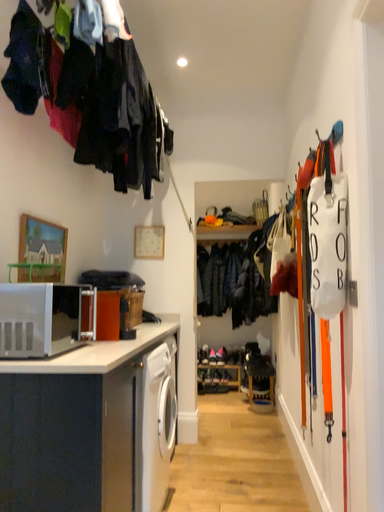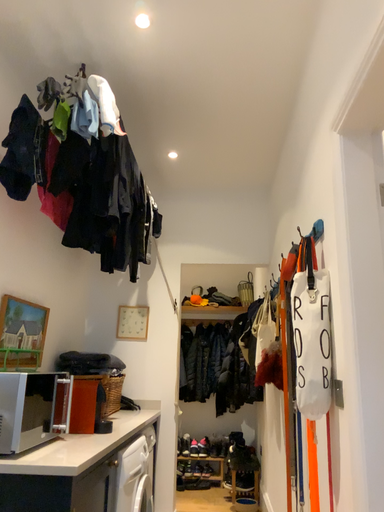
Question: Which way did the camera rotate in the video?

Choices:
 (A) rotated downward
 (B) rotated upward

Answer: (B)